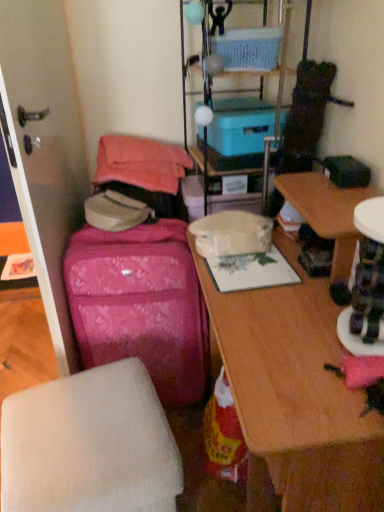
Question: Does pink fabric suitcase at left have a lesser width compared to blue cardboard box at upper center, arranged as the second storage box when ordered from the bottom?

Choices:
 (A) no
 (B) yes

Answer: (A)

Question: Is pink fabric suitcase at left to the left of blue cardboard box at upper center, arranged as the second storage box when ordered from the bottom, from the viewer's perspective?

Choices:
 (A) no
 (B) yes

Answer: (B)

Question: Can you see pink fabric suitcase at left touching blue cardboard box at upper center, arranged as the second storage box when ordered from the bottom?

Choices:
 (A) yes
 (B) no

Answer: (B)

Question: Is pink fabric suitcase at left oriented towards blue cardboard box at upper center, marked as the 1th storage box in a top-to-bottom arrangement?

Choices:
 (A) no
 (B) yes

Answer: (A)

Question: Can you confirm if pink fabric suitcase at left is wider than blue cardboard box at upper center, arranged as the second storage box when ordered from the bottom?

Choices:
 (A) no
 (B) yes

Answer: (B)

Question: Considering the relative positions of white matte ottoman at lower left and blue cardboard box at upper center, marked as the 1th storage box in a top-to-bottom arrangement, in the image provided, is white matte ottoman at lower left to the left or to the right of blue cardboard box at upper center, marked as the 1th storage box in a top-to-bottom arrangement,?

Choices:
 (A) right
 (B) left

Answer: (B)

Question: Is white matte ottoman at lower left bigger or smaller than blue cardboard box at upper center, marked as the 1th storage box in a top-to-bottom arrangement?

Choices:
 (A) small
 (B) big

Answer: (B)

Question: Which is correct: white matte ottoman at lower left is inside blue cardboard box at upper center, marked as the 1th storage box in a top-to-bottom arrangement, or outside of it?

Choices:
 (A) outside
 (B) inside

Answer: (A)

Question: Is point (54, 484) closer or farther from the camera than point (273, 33)?

Choices:
 (A) closer
 (B) farther

Answer: (A)

Question: From a real-world perspective, is wooden desk at center positioned above or below pink fabric suitcase at left?

Choices:
 (A) below
 (B) above

Answer: (B)

Question: From their relative heights in the image, would you say wooden desk at center is taller or shorter than pink fabric suitcase at left?

Choices:
 (A) tall
 (B) short

Answer: (A)

Question: Relative to pink fabric suitcase at left, is wooden desk at center in front or behind?

Choices:
 (A) behind
 (B) front

Answer: (B)

Question: Is wooden desk at center bigger or smaller than pink fabric suitcase at left?

Choices:
 (A) small
 (B) big

Answer: (B)

Question: Do you think white matte ottoman at lower left is within wooden desk at center, or outside of it?

Choices:
 (A) outside
 (B) inside

Answer: (A)

Question: From a real-world perspective, is white matte ottoman at lower left physically located above or below wooden desk at center?

Choices:
 (A) above
 (B) below

Answer: (B)